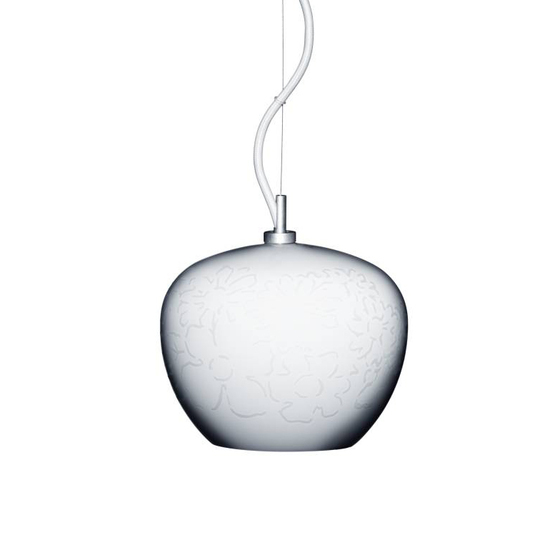
I want to click on lamp, so click(x=329, y=344).